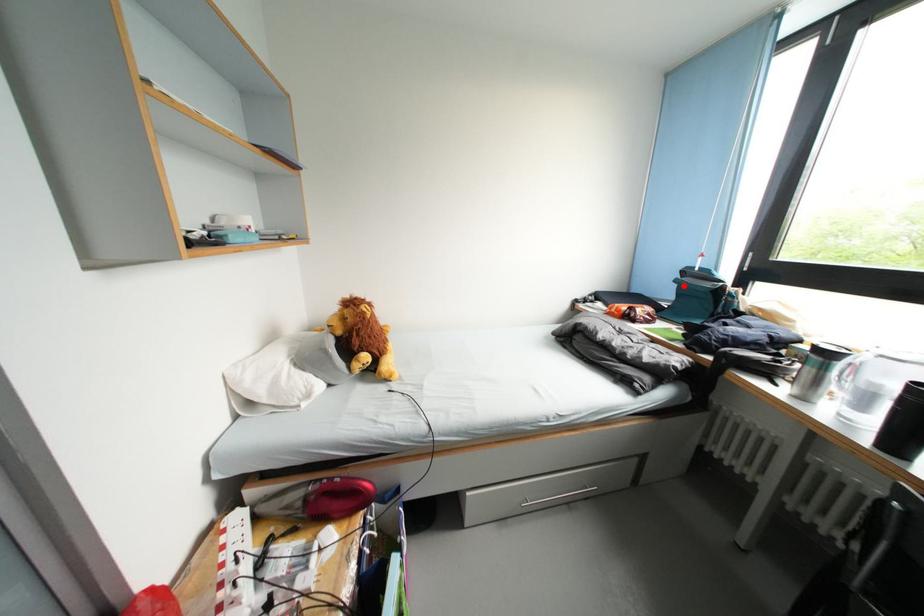
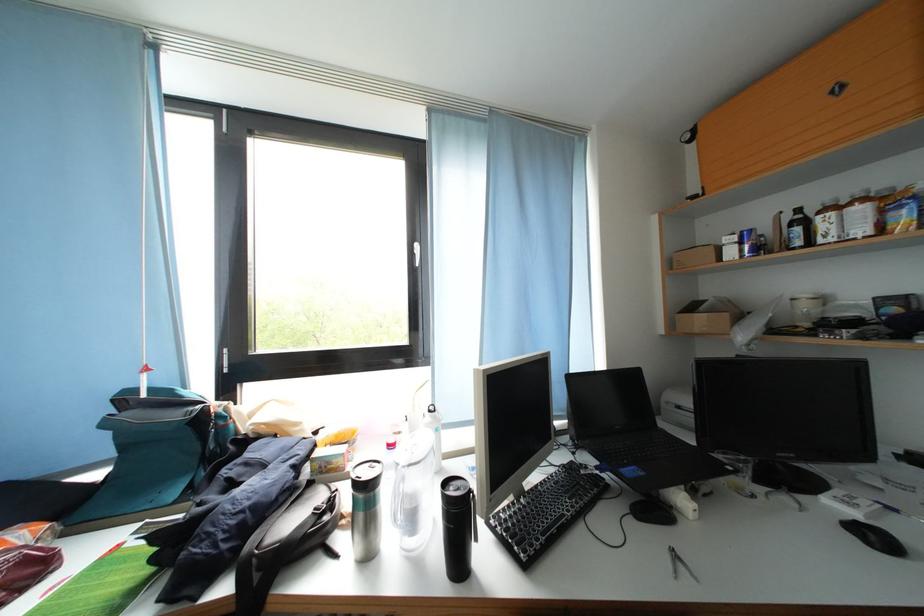
The point at the highlighted location is marked in the first image. Where is the corresponding point in the second image?

(114, 429)